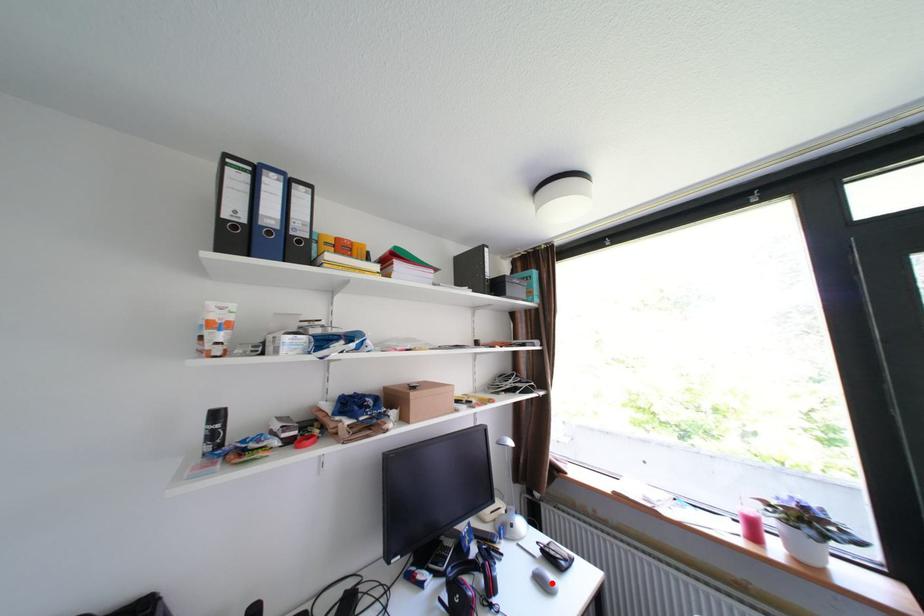
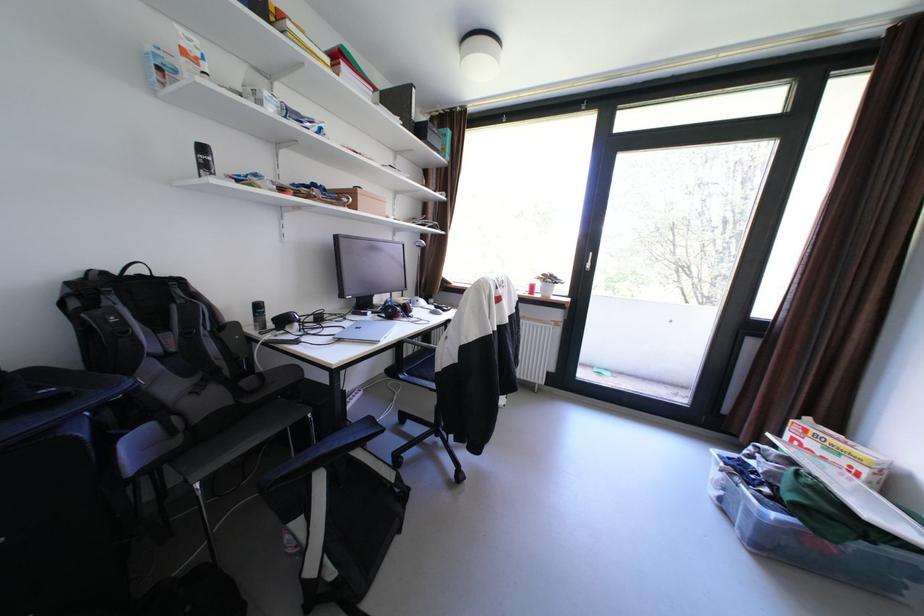
The point at the highlighted location is marked in the first image. Where is the corresponding point in the second image?

(444, 314)